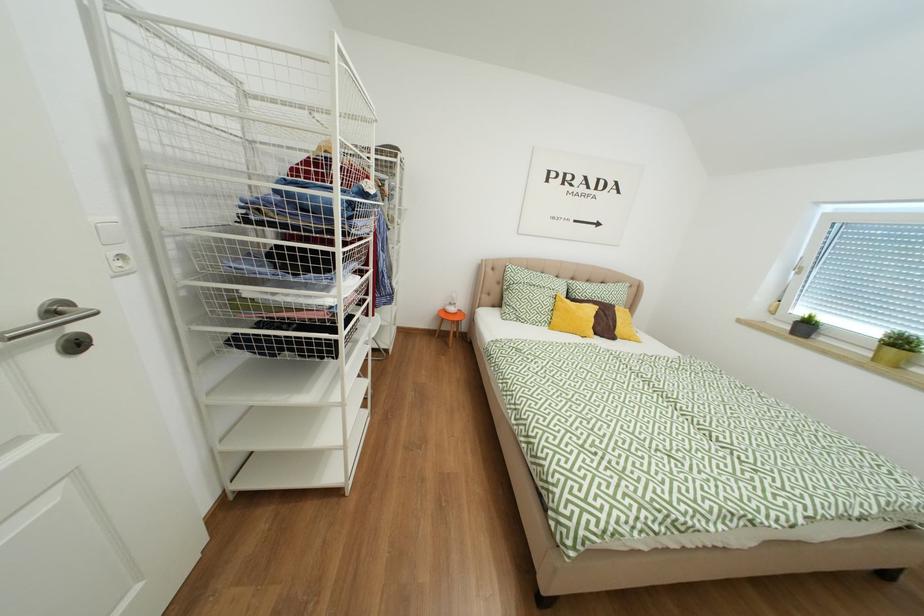
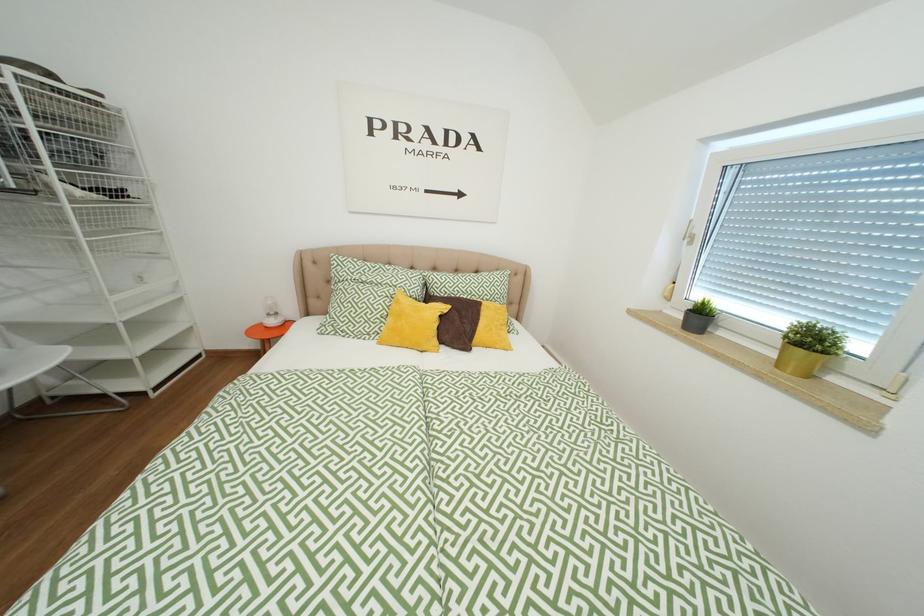
The images are taken continuously from a first-person perspective. In which direction are you moving?

The cameraman moved toward right, forward.